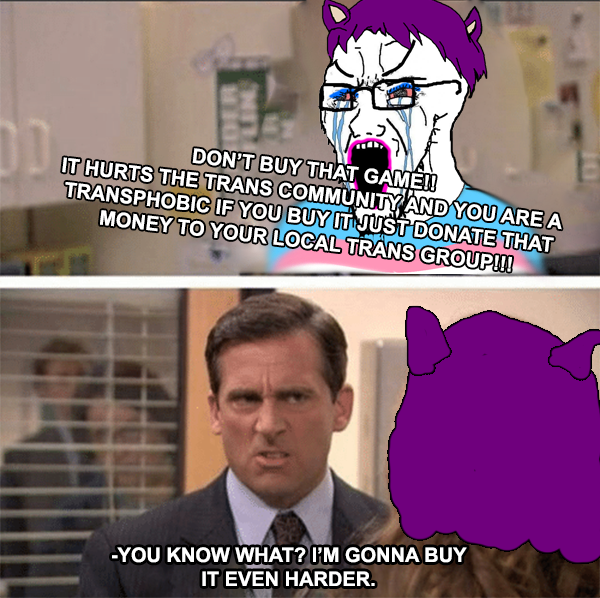
At what (x,y) coordinates should I click in order to perform the action: click on cabinet handle. Please return your answer as a coordinate pair (x, y). This screenshot has height=598, width=600. Looking at the image, I should click on (48, 135), (13, 167).